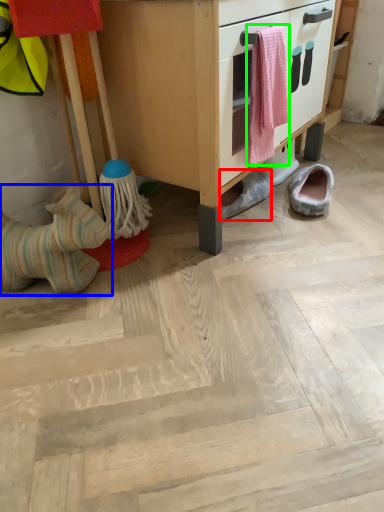
Question: Considering the real-world distances, which object is farthest from footwear (highlighted by a red box)? footwear (highlighted by a blue box) or laundry (highlighted by a green box)?

Choices:
 (A) footwear
 (B) laundry

Answer: (A)